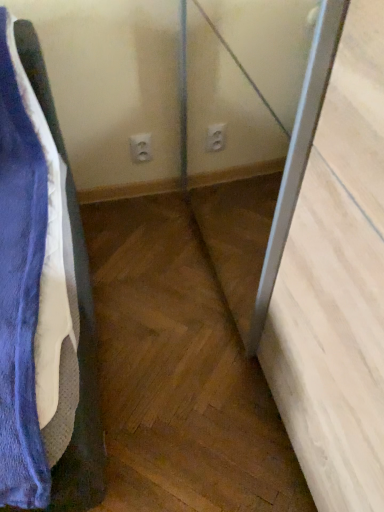
Question: Is white plastic electric outlet at center inside clear glass screen door at center?

Choices:
 (A) yes
 (B) no

Answer: (B)

Question: Is clear glass screen door at center wider than white plastic electric outlet at center?

Choices:
 (A) no
 (B) yes

Answer: (B)

Question: Considering the relative sizes of clear glass screen door at center and white plastic electric outlet at center in the image provided, is clear glass screen door at center smaller than white plastic electric outlet at center?

Choices:
 (A) no
 (B) yes

Answer: (A)

Question: Does clear glass screen door at center appear on the right side of white plastic electric outlet at center?

Choices:
 (A) no
 (B) yes

Answer: (B)

Question: Is clear glass screen door at center directly adjacent to white plastic electric outlet at center?

Choices:
 (A) yes
 (B) no

Answer: (B)

Question: Does clear glass screen door at center appear on the left side of white plastic electric outlet at center?

Choices:
 (A) no
 (B) yes

Answer: (A)

Question: Would you say clear glass screen door at center is part of white plastic electric outlet at center's contents?

Choices:
 (A) no
 (B) yes

Answer: (A)

Question: Is white plastic electric outlet at center wider than clear glass screen door at center?

Choices:
 (A) no
 (B) yes

Answer: (A)

Question: Does white plastic electric outlet at center appear on the left side of clear glass screen door at center?

Choices:
 (A) no
 (B) yes

Answer: (B)

Question: Does white plastic electric outlet at center turn towards clear glass screen door at center?

Choices:
 (A) no
 (B) yes

Answer: (A)

Question: Considering the relative sizes of white plastic electric outlet at center and clear glass screen door at center in the image provided, is white plastic electric outlet at center smaller than clear glass screen door at center?

Choices:
 (A) no
 (B) yes

Answer: (B)

Question: Does white plastic electric outlet at center have a greater height compared to clear glass screen door at center?

Choices:
 (A) yes
 (B) no

Answer: (B)

Question: Which is correct: clear glass screen door at center is inside white plastic electric outlet at center, or outside of it?

Choices:
 (A) inside
 (B) outside

Answer: (B)